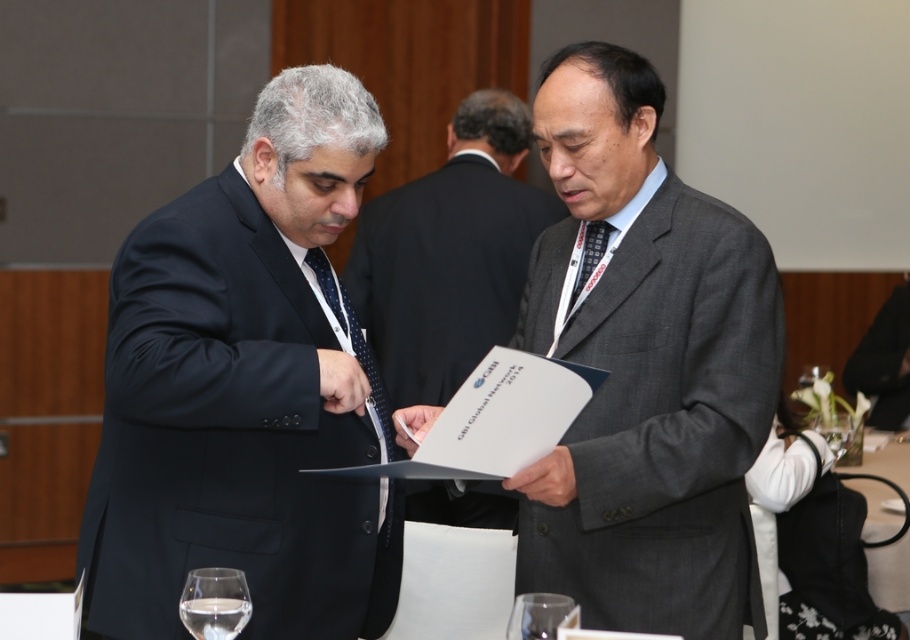
Question: Estimate the real-world distances between objects in this image. Which object is farther from the gray textured suit at center?

Choices:
 (A) black fabric business suit at lower right
 (B) clear glass wine glass at lower left
 (C) clear glass wine glass at lower center
 (D) transparent glass at lower center

Answer: (A)

Question: Can you confirm if matte black suit at left is positioned to the left of transparent glass at lower center?

Choices:
 (A) yes
 (B) no

Answer: (A)

Question: Which of the following is the farthest from the observer?

Choices:
 (A) (193, 604)
 (B) (517, 225)
 (C) (836, 435)
 (D) (868, 364)

Answer: (D)

Question: Does gray textured suit at center have a smaller size compared to matte gray suit at center?

Choices:
 (A) no
 (B) yes

Answer: (B)

Question: Which object appears closest to the camera in this image?

Choices:
 (A) clear glass wine glass at lower left
 (B) transparent glass at lower center

Answer: (B)

Question: Is gray textured suit at center wider than clear glass wine glass at lower left?

Choices:
 (A) yes
 (B) no

Answer: (A)